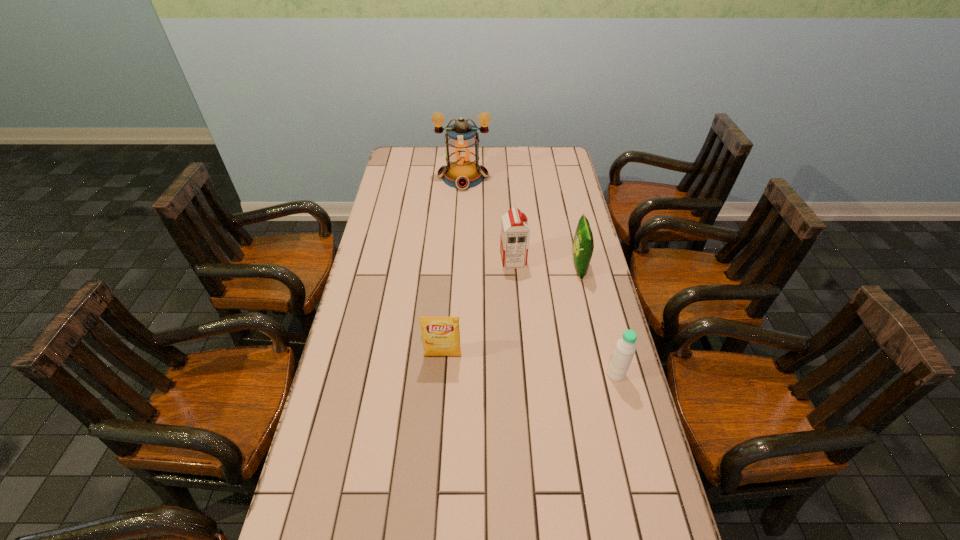
Identify the location of vacant area situated 0.240m on the front-facing side of the farther crisp (potato chip). (505, 267).

Locate an element on the screen. The height and width of the screenshot is (540, 960). vacant region located 0.360m on the front-facing side of the farther crisp (potato chip) is located at coordinates (471, 267).

The image size is (960, 540). What are the coordinates of `vacant point located on the left of the nearest object` in the screenshot? It's located at (478, 374).

The image size is (960, 540). Find the location of `free space located 0.190m on the front of the nearer crisp (potato chip) with the logo`. free space located 0.190m on the front of the nearer crisp (potato chip) with the logo is located at coordinates (438, 422).

Where is `object that is at the far edge`? This screenshot has height=540, width=960. object that is at the far edge is located at coordinates (463, 171).

Locate an element on the screen. This screenshot has width=960, height=540. crisp (potato chip) situated at the right edge is located at coordinates (583, 247).

Image resolution: width=960 pixels, height=540 pixels. Identify the location of water bottle located at the right edge. (623, 353).

In the image, there is a desktop. Identify the location of free space at the far edge. The width and height of the screenshot is (960, 540). (488, 171).

Find the location of a particular element. This screenshot has height=540, width=960. vacant area at the left edge is located at coordinates (373, 343).

This screenshot has height=540, width=960. I want to click on blank space at the right edge of the desktop, so click(579, 211).